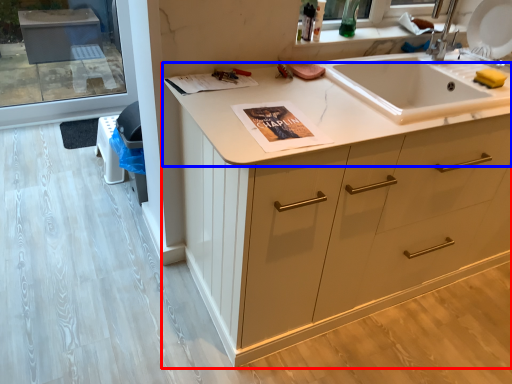
Question: Which object is further to the camera taking this photo, cabinetry (highlighted by a red box) or countertop (highlighted by a blue box)?

Choices:
 (A) cabinetry
 (B) countertop

Answer: (B)